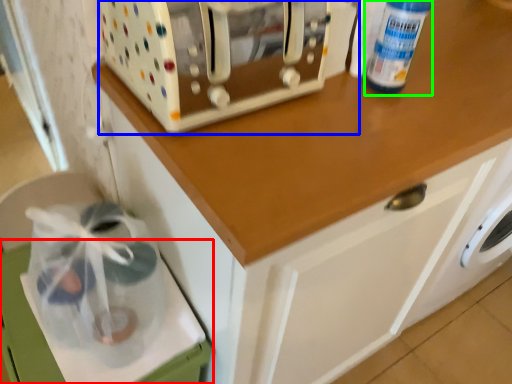
Question: Which object is positioned closest to cabinetry (highlighted by a red box)? Select from home appliance (highlighted by a blue box) and bottle (highlighted by a green box).

Choices:
 (A) home appliance
 (B) bottle

Answer: (A)